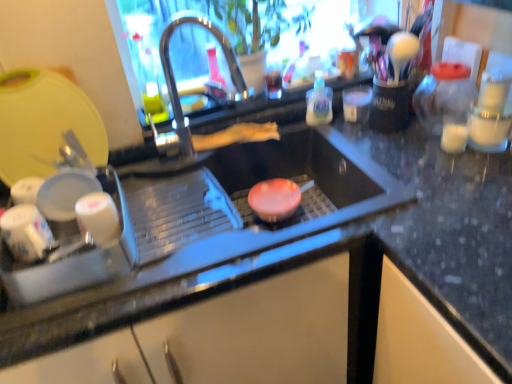
Question: Is white glossy cups at left, which is the second appliance in top-to-bottom order, to the right of yellow plastic cutting board at upper left, which is the 1th appliance in top-to-bottom order, from the viewer's perspective?

Choices:
 (A) yes
 (B) no

Answer: (A)

Question: Is white glossy cups at left, the 1th appliance in the bottom-to-top sequence, aimed at yellow plastic cutting board at upper left, which is the 1th appliance in top-to-bottom order?

Choices:
 (A) no
 (B) yes

Answer: (A)

Question: Can you confirm if white glossy cups at left, which is the second appliance in top-to-bottom order, is positioned to the left of yellow plastic cutting board at upper left, which is the 1th appliance in top-to-bottom order?

Choices:
 (A) yes
 (B) no

Answer: (B)

Question: Can you confirm if white glossy cups at left, which is the second appliance in top-to-bottom order, is wider than yellow plastic cutting board at upper left, the 2th appliance from the bottom?

Choices:
 (A) no
 (B) yes

Answer: (B)

Question: Are white glossy cups at left, the 1th appliance in the bottom-to-top sequence, and yellow plastic cutting board at upper left, the 2th appliance from the bottom, located far from each other?

Choices:
 (A) yes
 (B) no

Answer: (B)

Question: Relative to translucent plastic bottle at upper right, is polished stainless steel tap at center in front or behind?

Choices:
 (A) front
 (B) behind

Answer: (A)

Question: Visually, is polished stainless steel tap at center positioned to the left or to the right of translucent plastic bottle at upper right?

Choices:
 (A) left
 (B) right

Answer: (A)

Question: Considering the positions of point (x=167, y=145) and point (x=307, y=91), is point (x=167, y=145) closer or farther from the camera than point (x=307, y=91)?

Choices:
 (A) farther
 (B) closer

Answer: (B)

Question: From a real-world perspective, is polished stainless steel tap at center physically located above or below translucent plastic bottle at upper right?

Choices:
 (A) above
 (B) below

Answer: (A)

Question: Considering the relative positions of polished stainless steel tap at center and white glossy cups at left, the 1th appliance in the bottom-to-top sequence, in the image provided, is polished stainless steel tap at center to the left or to the right of white glossy cups at left, the 1th appliance in the bottom-to-top sequence,?

Choices:
 (A) right
 (B) left

Answer: (A)

Question: Is polished stainless steel tap at center wider or thinner than white glossy cups at left, the 1th appliance in the bottom-to-top sequence?

Choices:
 (A) thin
 (B) wide

Answer: (A)

Question: Does point (176, 23) appear closer or farther from the camera than point (71, 142)?

Choices:
 (A) farther
 (B) closer

Answer: (A)

Question: From the image's perspective, is polished stainless steel tap at center located above or below white glossy cups at left, the 1th appliance in the bottom-to-top sequence?

Choices:
 (A) above
 (B) below

Answer: (A)

Question: Based on their sizes in the image, would you say white glossy cups at left, the 1th appliance in the bottom-to-top sequence, is bigger or smaller than translucent plastic bottle at upper right?

Choices:
 (A) small
 (B) big

Answer: (B)

Question: Considering the relative positions of white glossy cups at left, which is the second appliance in top-to-bottom order, and translucent plastic bottle at upper right in the image provided, is white glossy cups at left, which is the second appliance in top-to-bottom order, to the left or to the right of translucent plastic bottle at upper right?

Choices:
 (A) left
 (B) right

Answer: (A)